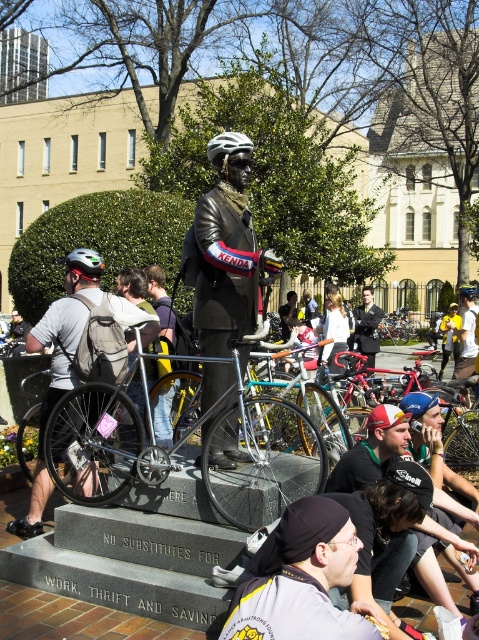
Question: Estimate the real-world distances between objects in this image. Which object is closer to the black matte bicycle helmet at center?

Choices:
 (A) red cap at center
 (B) black leather jacket at center
 (C) shiny silver bicycle at center

Answer: (C)

Question: Does bronze statue at center have a smaller size compared to matte black helmet at upper left?

Choices:
 (A) no
 (B) yes

Answer: (A)

Question: Which object is the closest to the black leather jacket at center?

Choices:
 (A) blue matte bicycle helmet at center
 (B) black matte bicycle helmet at center

Answer: (A)

Question: Is black leather jacket at center closer to camera compared to blue matte bicycle helmet at center?

Choices:
 (A) yes
 (B) no

Answer: (A)

Question: In this image, where is shiny silver bicycle at center located relative to blue matte bicycle helmet at center?

Choices:
 (A) above
 (B) below

Answer: (B)

Question: Which of the following is the closest to the observer?

Choices:
 (A) yellow fabric shirt at center
 (B) shiny silver bicycle at center
 (C) yellow backpack at center

Answer: (B)